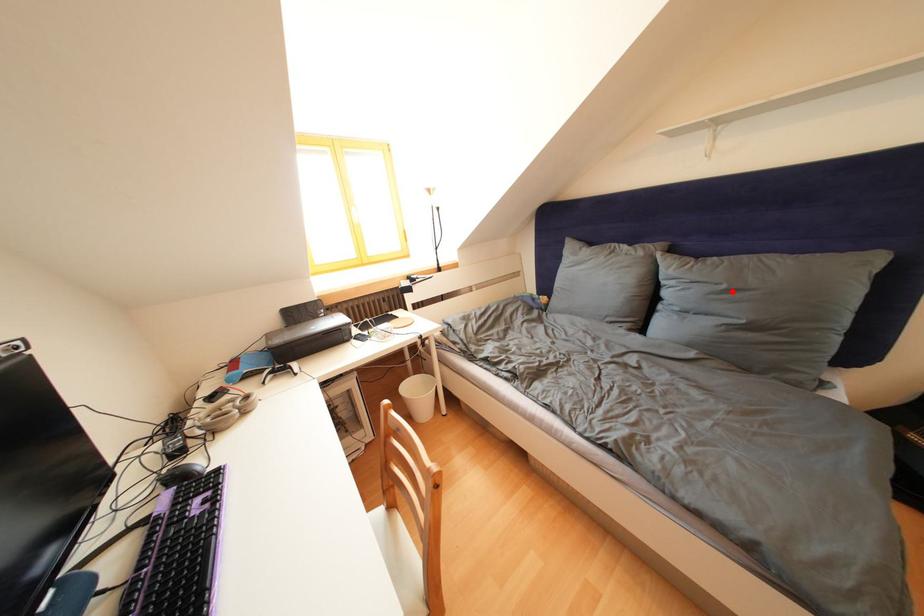
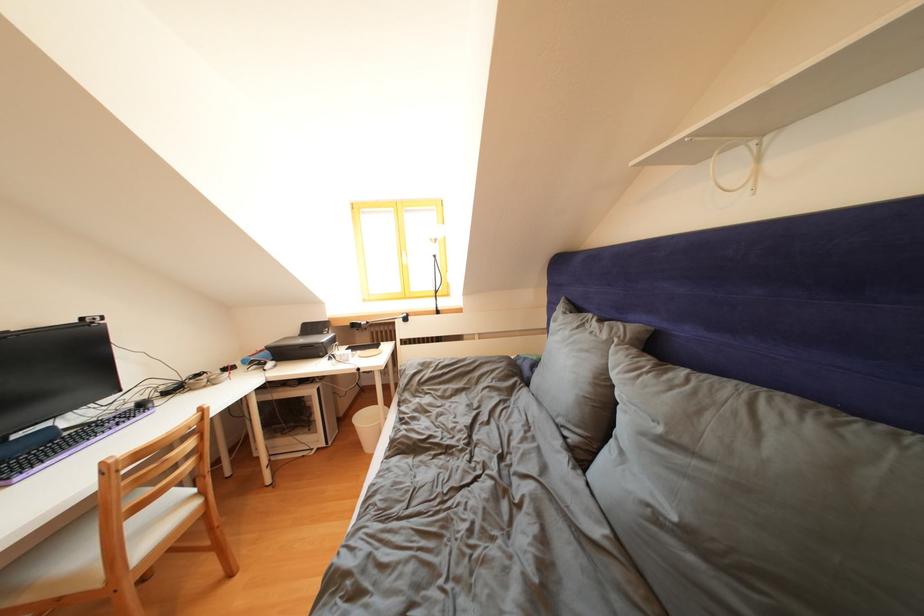
Where in the second image is the point corresponding to the highlighted location from the first image?

(667, 435)